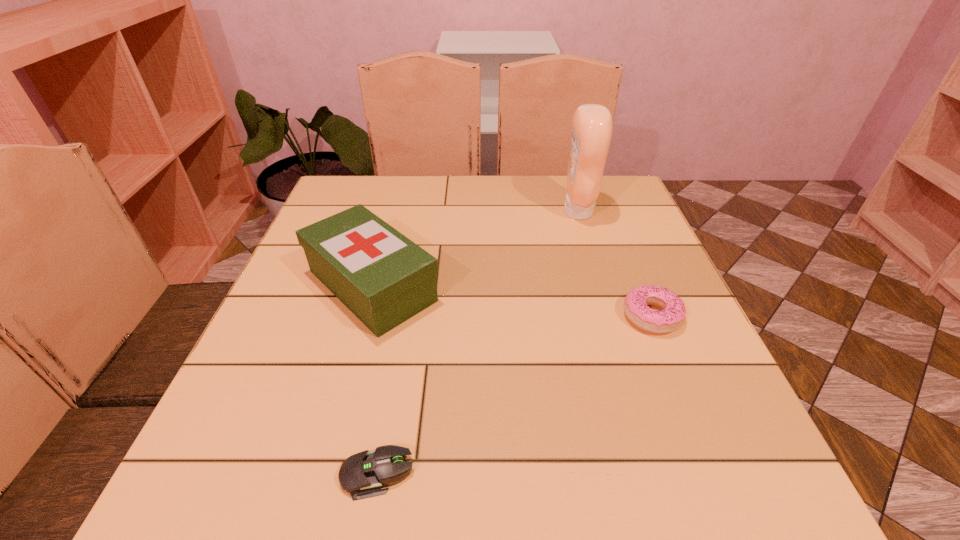
This screenshot has height=540, width=960. What are the coordinates of `condiment` in the screenshot? It's located at (592, 126).

You are a GUI agent. You are given a task and a screenshot of the screen. Output one action in this format:
    pyautogui.click(x=<x>, y=<y>)
    Task: Click on the tallest object
    
    Given the screenshot: What is the action you would take?
    pyautogui.click(x=592, y=126)

At what (x,y) coordinates should I click in order to perform the action: click on the first-aid kit. Please return your answer as a coordinate pair (x, y). The height and width of the screenshot is (540, 960). Looking at the image, I should click on (381, 276).

Locate an element on the screen. the second shortest object is located at coordinates (671, 316).

This screenshot has width=960, height=540. Identify the location of the nearest object. (362, 475).

This screenshot has height=540, width=960. I want to click on computer mouse, so click(362, 475).

Locate an element on the screen. Image resolution: width=960 pixels, height=540 pixels. vacant space located 0.190m on the label of the tallest object is located at coordinates (492, 211).

You are a GUI agent. You are given a task and a screenshot of the screen. Output one action in this format:
    pyautogui.click(x=<x>, y=<y>)
    Task: Click on the free space located on the label of the tallest object
    
    Given the screenshot: What is the action you would take?
    pyautogui.click(x=446, y=211)

Where is `free space located 0.390m on the label of the tallest object`? free space located 0.390m on the label of the tallest object is located at coordinates (418, 211).

Locate an element on the screen. The height and width of the screenshot is (540, 960). vacant point located 0.080m on the back of the third shortest object is located at coordinates (389, 225).